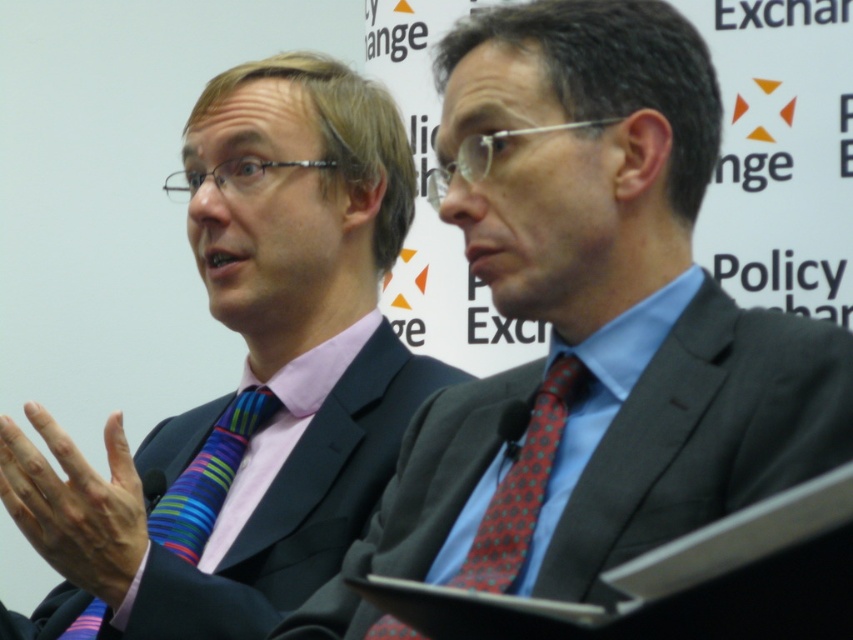
Question: Which object appears closest to the camera in this image?

Choices:
 (A) matte black suit at left
 (B) red dotted tie at center

Answer: (B)

Question: Is matte black suit at center below red dotted tie at center?

Choices:
 (A) yes
 (B) no

Answer: (B)

Question: Which point is closer to the camera?

Choices:
 (A) (97, 545)
 (B) (581, 387)
 (C) (467, 74)

Answer: (A)

Question: Does matte black suit at center have a greater width compared to red dotted tie at center?

Choices:
 (A) yes
 (B) no

Answer: (A)

Question: Considering the relative positions of matte black suit at center and red dotted tie at center in the image provided, where is matte black suit at center located with respect to red dotted tie at center?

Choices:
 (A) right
 (B) left

Answer: (A)

Question: Which object is positioned closest to the striped silk tie at left?

Choices:
 (A) matte black suit at left
 (B) red dotted tie at center
 (C) matte black suit at center

Answer: (A)